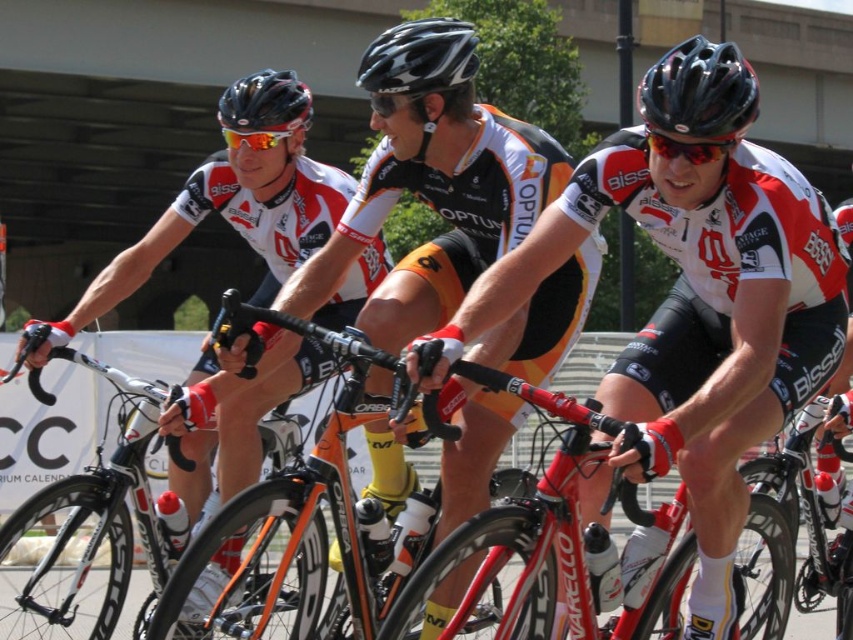
Looking at this image, does orange matte bicycle at center have a greater height compared to matte black helmet at upper center?

Indeed, orange matte bicycle at center has a greater height compared to matte black helmet at upper center.

Describe the element at coordinates (294, 509) in the screenshot. The height and width of the screenshot is (640, 853). I see `orange matte bicycle at center` at that location.

Where is `orange matte bicycle at center`? This screenshot has width=853, height=640. orange matte bicycle at center is located at coordinates (294, 509).

What do you see at coordinates (228, 218) in the screenshot? This screenshot has width=853, height=640. I see `matte black bicycle at left` at bounding box center [228, 218].

Can you confirm if matte black bicycle at left is thinner than black matte helmet at upper right?

No, matte black bicycle at left is not thinner than black matte helmet at upper right.

The width and height of the screenshot is (853, 640). In order to click on matte black bicycle at left in this screenshot , I will do `click(228, 218)`.

Locate an element on the screen. matte black bicycle at left is located at coordinates pyautogui.click(x=228, y=218).

Is white matte jersey at center to the left of matte black helmet at upper center from the viewer's perspective?

In fact, white matte jersey at center is to the right of matte black helmet at upper center.

Who is higher up, white matte jersey at center or matte black helmet at upper center?

Positioned higher is matte black helmet at upper center.

Is point (738, 195) positioned behind point (259, 104)?

No, (738, 195) is closer to viewer.

Where is `white matte jersey at center`? This screenshot has width=853, height=640. white matte jersey at center is located at coordinates (694, 298).